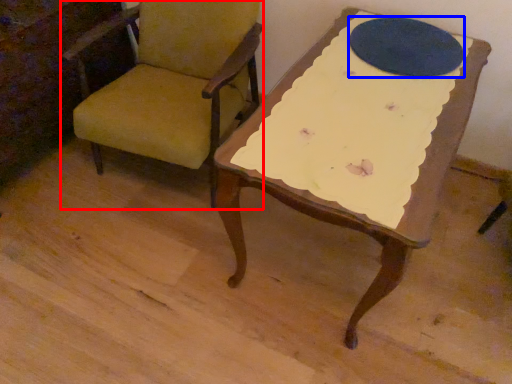
Question: Among these objects, which one is nearest to the camera, chair (highlighted by a red box) or oval (highlighted by a blue box)?

Choices:
 (A) chair
 (B) oval

Answer: (A)